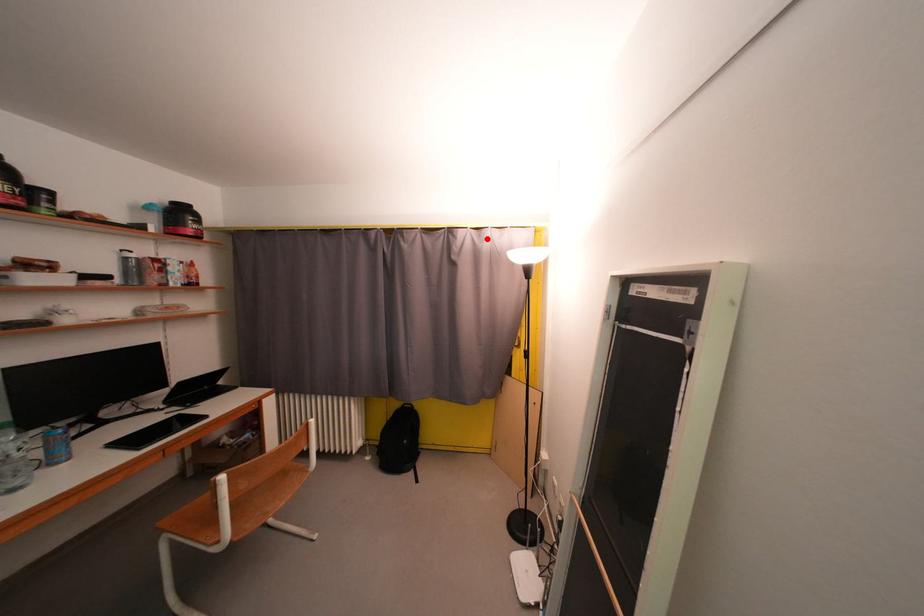
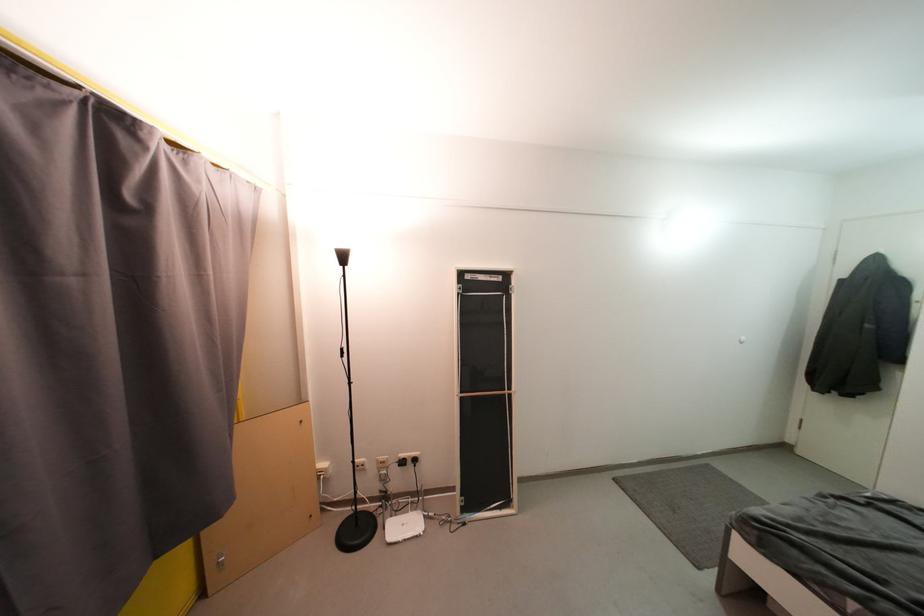
Where in the second image is the point corresponding to the highlighted location from the first image?

(192, 166)